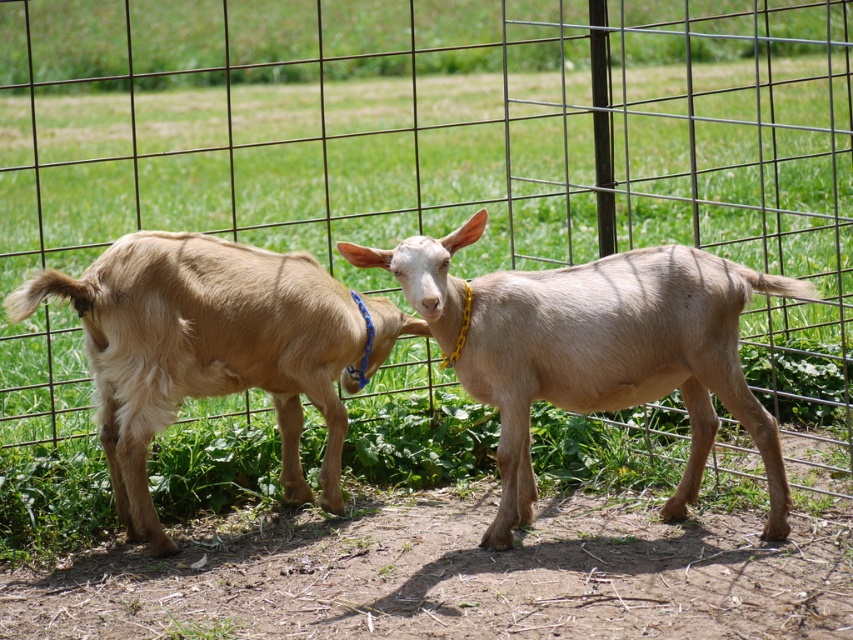
Based on the photo, you are a farmer checking the goats in the enclosure. You notice two light brown fur goats. Which one has a wider body, the light brown fur goat at center or the light brown fur goat at left?

The light brown fur goat at center has a wider body than the light brown fur goat at left.